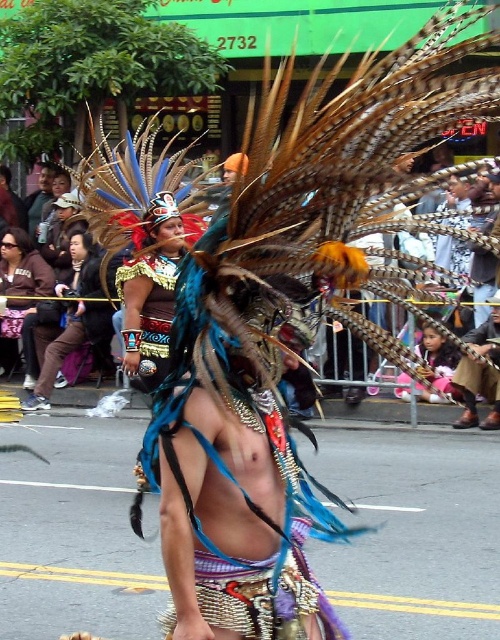
Question: Which of the following is the closest to the observer?

Choices:
 (A) (461, 364)
 (B) (37, 195)

Answer: (A)

Question: Which point is closer to the camera taking this photo?

Choices:
 (A) (493, 337)
 (B) (27, 196)

Answer: (A)

Question: Does leather boots at lower right lie in front of matte black headdress at center?

Choices:
 (A) yes
 (B) no

Answer: (A)

Question: Can you confirm if leather boots at lower right is positioned to the right of matte black headdress at center?

Choices:
 (A) yes
 (B) no

Answer: (A)

Question: Among these objects, which one is farthest from the camera?

Choices:
 (A) leather boots at lower right
 (B) matte black headdress at center

Answer: (B)

Question: Does leather boots at lower right have a greater width compared to matte black headdress at center?

Choices:
 (A) no
 (B) yes

Answer: (B)